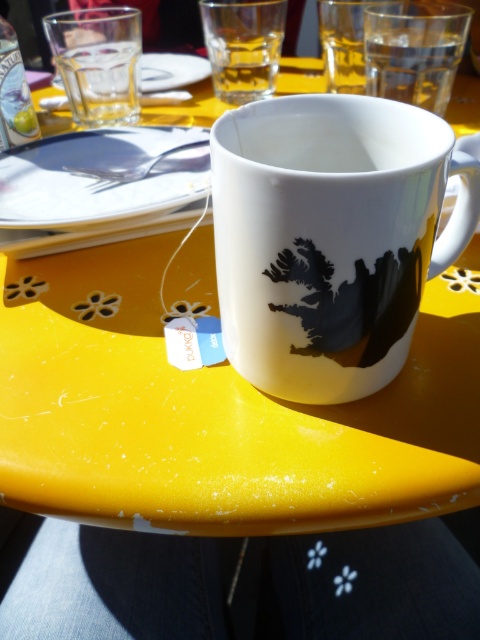
You have a small cookie that is 3 cm in diameter. You want to place it on either the white porcelain saucer at upper center or the transparent glass at upper left. Which object can the cookie fit on without overhanging?

The white porcelain saucer at upper center has a width less than the transparent glass at upper left, so the cookie will fit better on the transparent glass at upper left since it has a larger surface area.

In the scene shown: You have a small spoon that is 5 inches long. You want to place it between the white glossy mug at center and the white porcelain saucer at upper center. Can the spoon fit entirely between them without overlapping either object?

The distance between the white glossy mug at center and the white porcelain saucer at upper center is 9.54 inches. Since the spoon is only 5 inches long, it can fit entirely between them without overlapping either object.

You are setting up a small table for a tea party. You have a white glossy mug at center and a transparent glass at upper left. Which object should you place closer to the edge of the table to prevent it from tipping over?

The transparent glass at upper left should be placed closer to the edge of the table because it is shorter than the white glossy mug at center, making it less stable and more prone to tipping over.